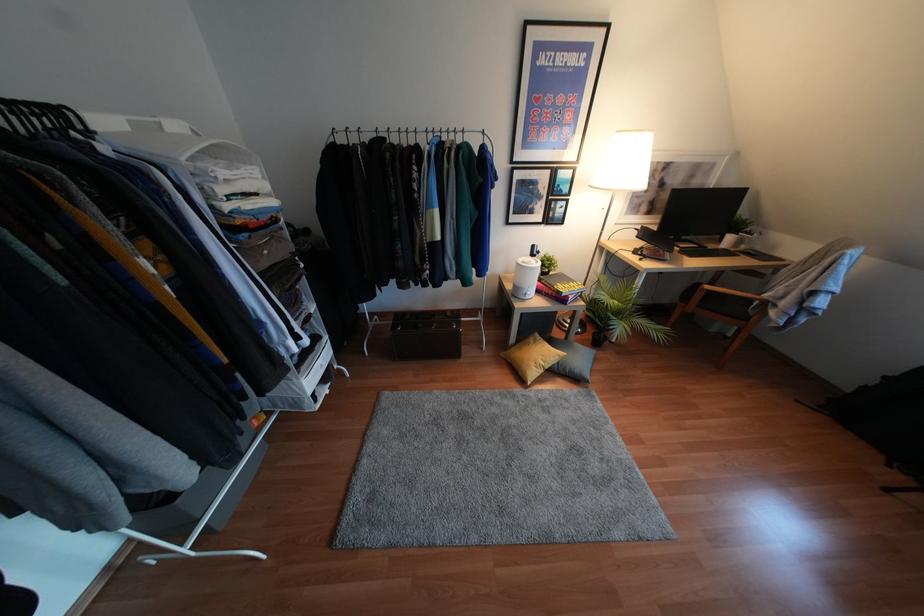
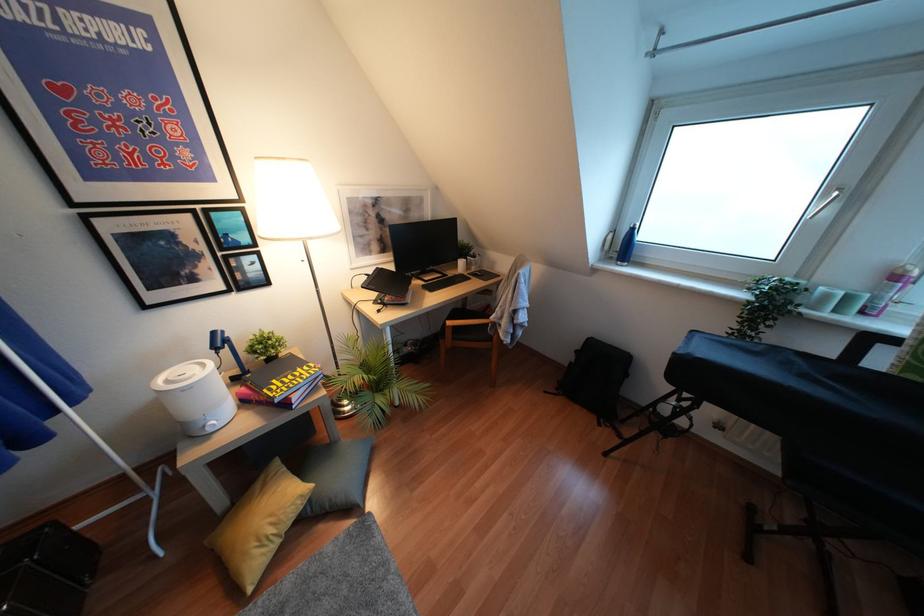
Find the pixel in the second image that matches (556,362) in the first image.

(310, 500)